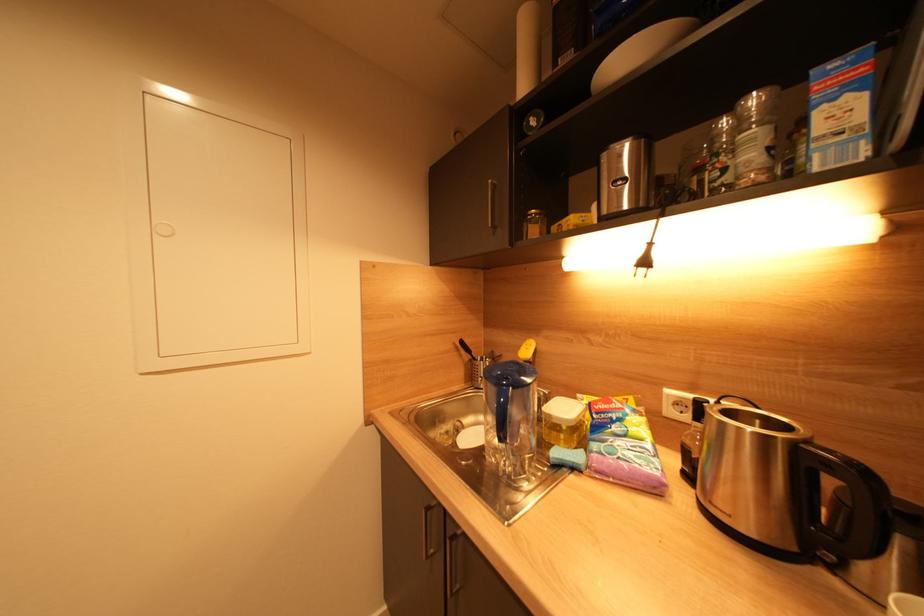
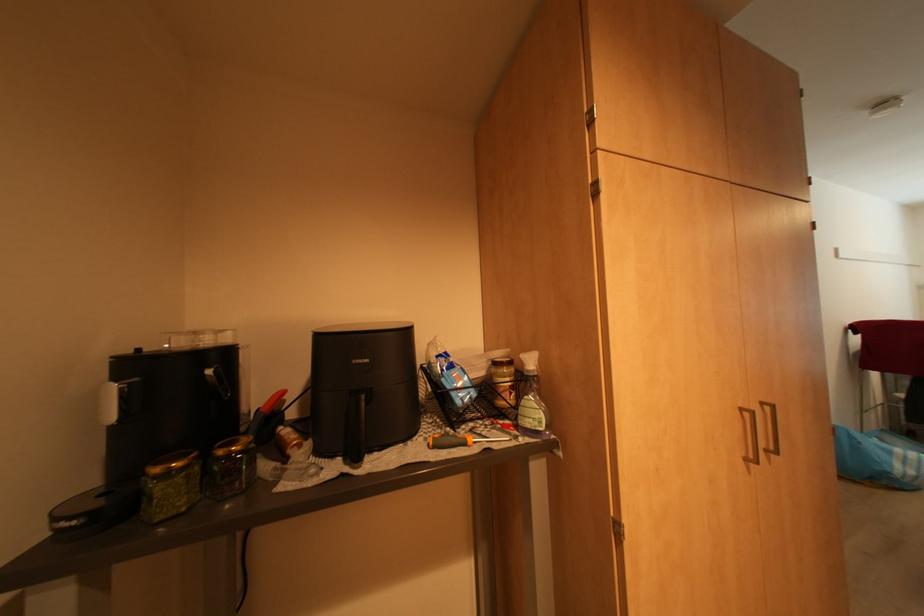
Question: The camera is either moving clockwise (left) or counter-clockwise (right) around the object. The first image is from the beginning of the video and the second image is from the end. Is the camera moving left or right when shooting the video?

Choices:
 (A) Left
 (B) Right

Answer: (B)